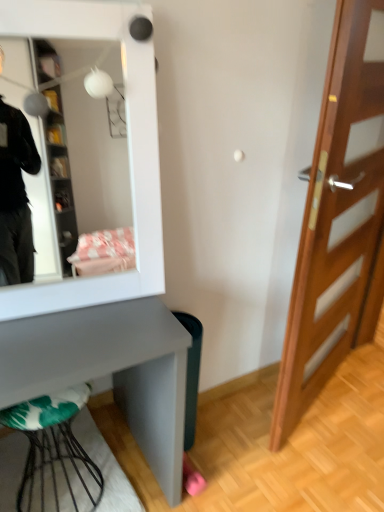
Identify the location of vacant space situated above metallic wire stool at lower left (from a real-world perspective). (56, 459).